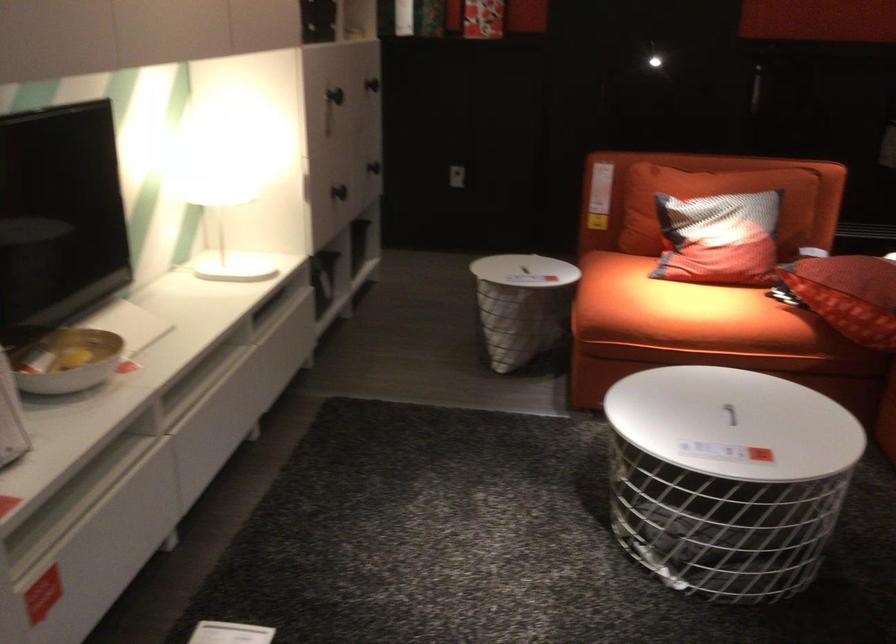
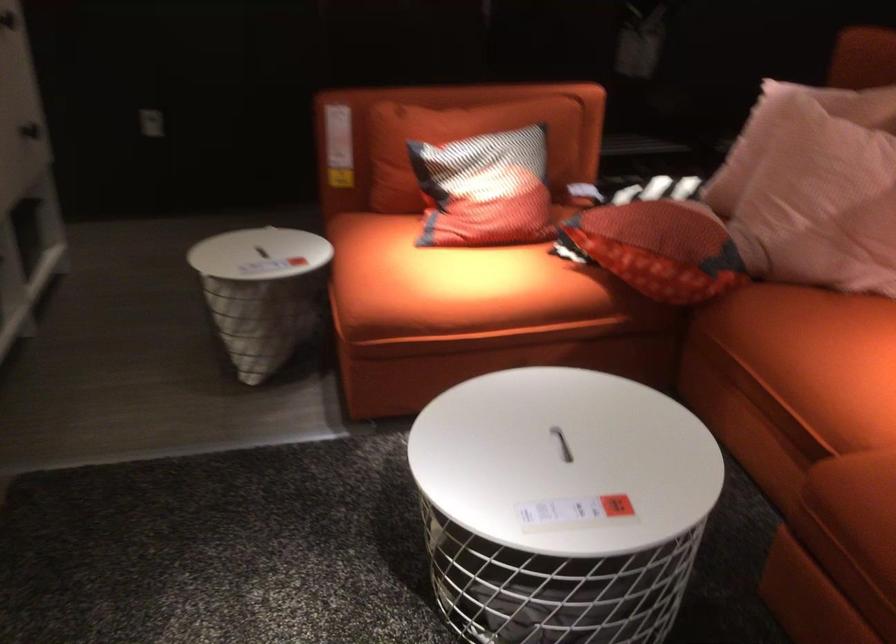
Locate, in the second image, the point that corresponds to point (676, 305) in the first image.

(449, 281)